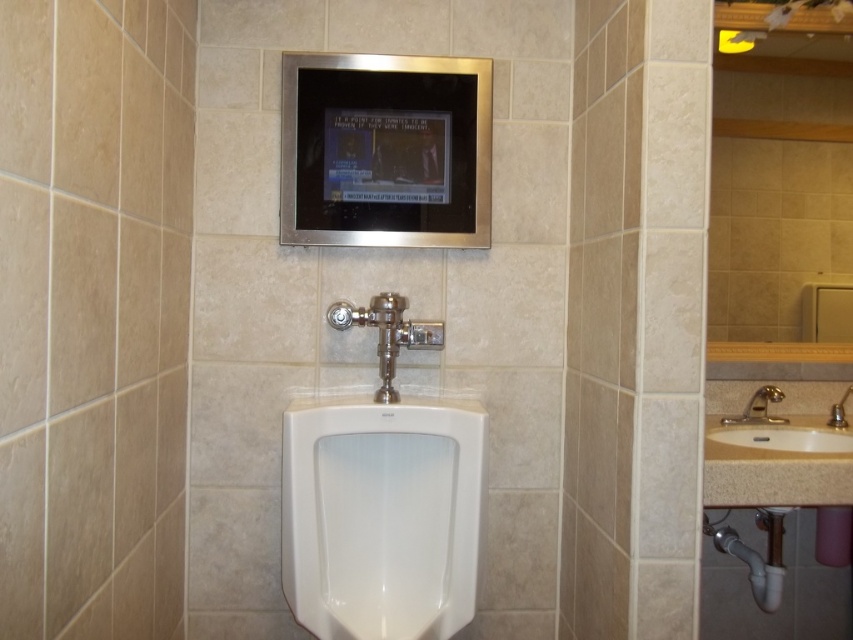
You are standing in the restroom and want to wash your hands. Which object should you approach first, the white ceramic sink at right or the silver metallic faucet at lower right?

You should approach the white ceramic sink at right first because it is in front of the silver metallic faucet at lower right, making it closer to you.

You are standing in the restroom and want to wash your hands. The white ceramic sink at right is located at point (779, 438). Is the sink to the left or right of the urinal?

The white ceramic sink at right is located to the right of the urinal as indicated by its coordinates at point (779, 438).

You are standing in the restroom and want to wash your hands. The white ceramic sink at right and the silver metallic faucet at lower right are in your view. Which object should you approach first to turn on the water?

You should approach the silver metallic faucet at lower right first because the white ceramic sink at right is to the left of the silver metallic faucet at lower right, meaning the faucet is positioned to the right side of the sink, so turning on the faucet would be necessary before using the sink.